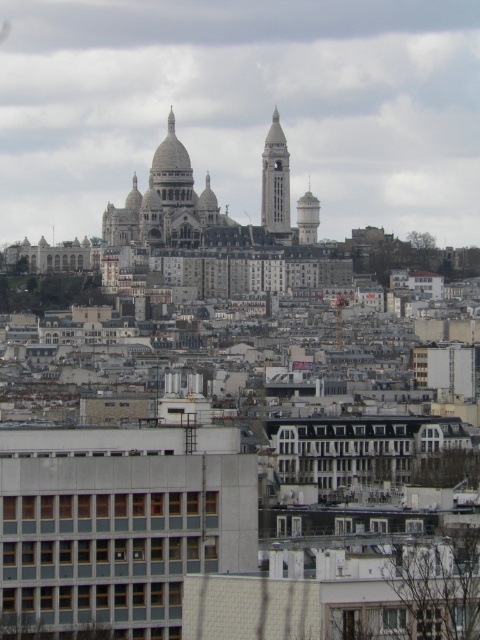
You are a city planner assessing the skyline of this area. You need to determine which of the two towers, the white stone clock tower at center or the light gray concrete tower at center right, is taller. Based on the provided information, which one is taller?

The white stone clock tower at center is taller than the light gray concrete tower at center right according to the description.

You are a city planner assessing the view of the golden stone church at center from the light gray concrete tower at center right. Given that the minimum required distance for an unobstructed view between two landmarks is 30 meters, is the current distance sufficient?

The golden stone church at center and the light gray concrete tower at center right are 29.50 meters apart from each other. Since the required distance is 30 meters, the current distance is insufficient to ensure an unobstructed view.

You are a tourist standing at the entrance of the city square. You want to take a photo of the white stone clock tower at center. Where should you stand to ensure the clock tower is centered in your camera viewfinder?

The white stone clock tower at center is located at coordinates point (x=276, y=182), so you should position yourself directly in front of that point to center it in your camera viewfinder.